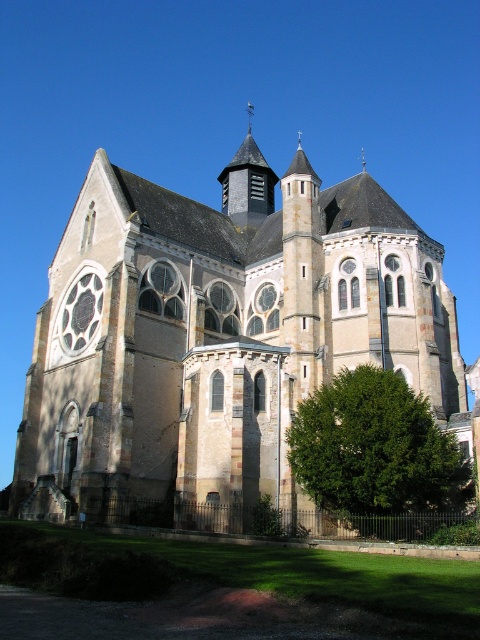
Does stone church at center appear on the left side of green leafy tree at lower right?

Yes, stone church at center is to the left of green leafy tree at lower right.

Is stone church at center to the right of green leafy tree at lower right from the viewer's perspective?

Incorrect, stone church at center is not on the right side of green leafy tree at lower right.

Does point (142, 452) come in front of point (337, 412)?

That is False.

This screenshot has width=480, height=640. In order to click on stone church at center in this screenshot , I will do `click(218, 333)`.